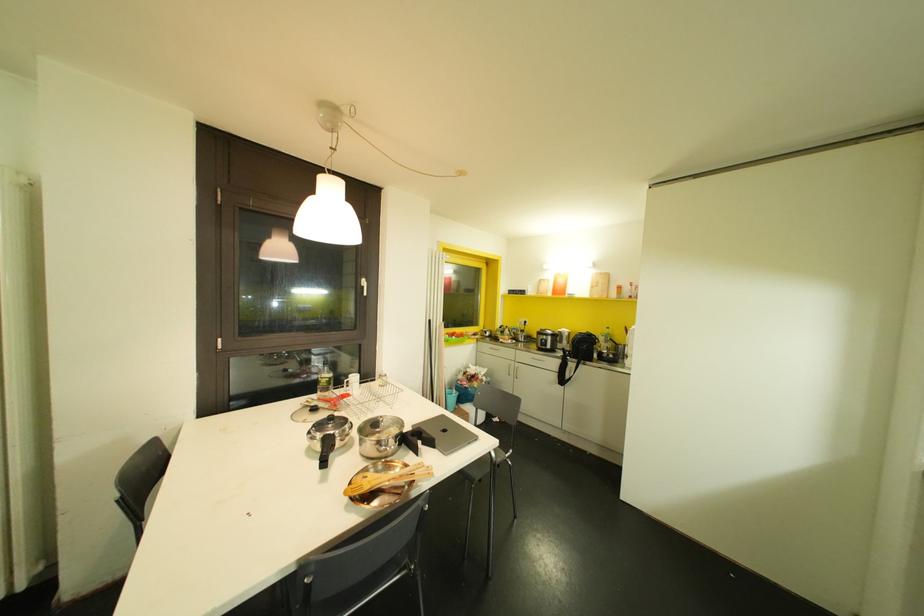
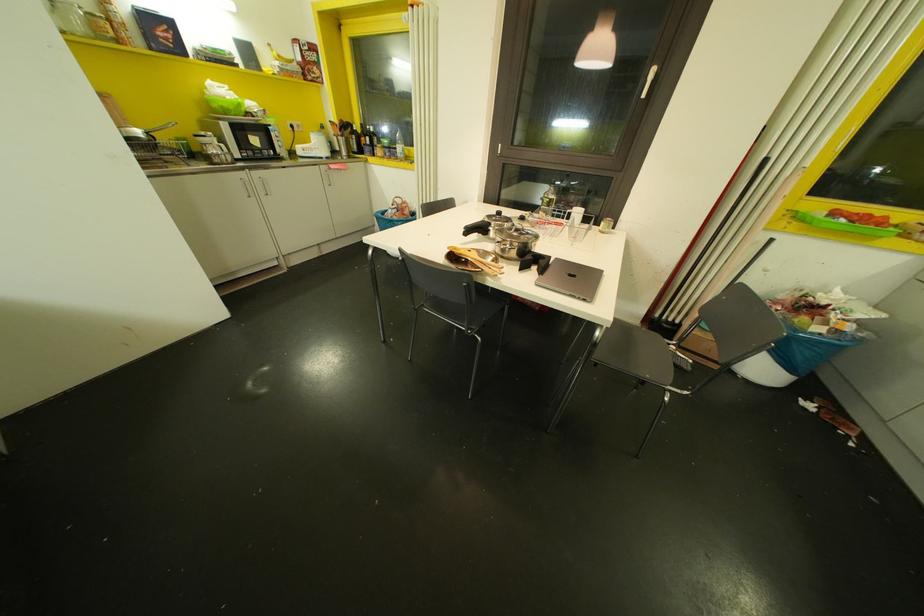
First-person continuous shooting, in which direction is the camera rotating?

A: The camera's rotation is toward left-down.